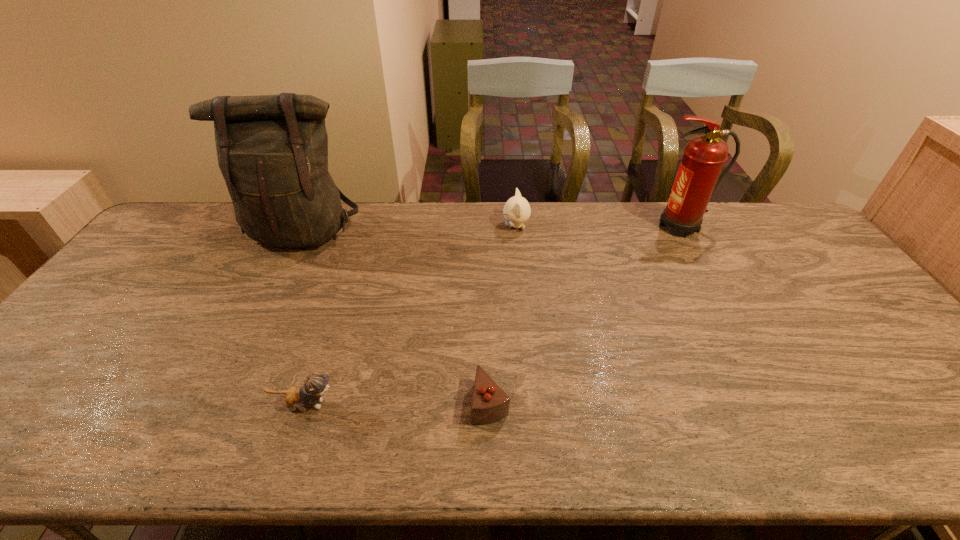
Identify the location of kitten located in the far edge section of the desktop. Image resolution: width=960 pixels, height=540 pixels. (517, 210).

Image resolution: width=960 pixels, height=540 pixels. What are the coordinates of `object that is positioned at the near edge` in the screenshot? It's located at 490,403.

Locate an element on the screen. This screenshot has height=540, width=960. free spot at the far edge of the desktop is located at coordinates (380, 202).

Where is `vacant space at the near edge`? The width and height of the screenshot is (960, 540). vacant space at the near edge is located at coordinates (796, 461).

The image size is (960, 540). In order to click on vacant space at the left edge of the desktop in this screenshot , I will do `click(94, 377)`.

I want to click on vacant space at the far right corner of the desktop, so click(x=783, y=234).

The image size is (960, 540). What are the coordinates of `free area in between the right kitten and the chocolate cake` in the screenshot? It's located at (503, 314).

This screenshot has width=960, height=540. I want to click on empty space that is in between the right kitten and the shorter kitten, so click(411, 315).

At what (x,y) coordinates should I click in order to perform the action: click on vacant area that lies between the fire extinguisher and the backpack. Please return your answer as a coordinate pair (x, y). Looking at the image, I should click on (492, 229).

Locate an element on the screen. Image resolution: width=960 pixels, height=540 pixels. free space between the backpack and the shorter kitten is located at coordinates (303, 319).